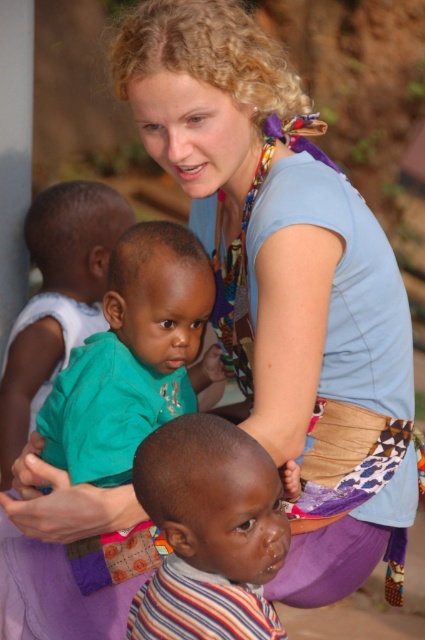
Which of these two, striped fabric shirt at center or green matte shirt at center, stands taller?

green matte shirt at center is taller.

The width and height of the screenshot is (425, 640). In order to click on striped fabric shirt at center in this screenshot , I will do `click(209, 531)`.

Does point (286, 538) lie in front of point (68, 259)?

Yes, point (286, 538) is closer to viewer.

You are a GUI agent. You are given a task and a screenshot of the screen. Output one action in this format:
    pyautogui.click(x=<x>, y=<y>)
    Task: Click on the striped fabric shirt at center
    The image size is (425, 640).
    Given the screenshot: What is the action you would take?
    pyautogui.click(x=209, y=531)

Does point (184, 556) come farther from viewer compared to point (85, 314)?

No, it is not.

Find the location of a particular element. striped fabric shirt at center is located at coordinates (209, 531).

Does green matte shirt at center come behind green fabric shirt at center?

No, it is not.

Does green matte shirt at center have a smaller size compared to green fabric shirt at center?

Indeed, green matte shirt at center has a smaller size compared to green fabric shirt at center.

Where is `green matte shirt at center`? The width and height of the screenshot is (425, 640). green matte shirt at center is located at coordinates (132, 356).